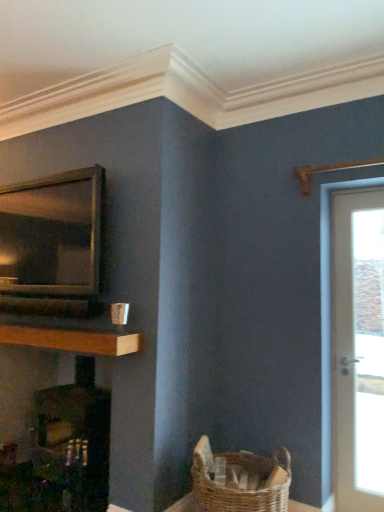
Question: From the image's perspective, relative to wooden at left, is matte black fireplace at left above or below?

Choices:
 (A) below
 (B) above

Answer: (A)

Question: Is point (99, 409) positioned closer to the camera than point (38, 335)?

Choices:
 (A) farther
 (B) closer

Answer: (A)

Question: Considering the real-world distances, which object is farthest from the white glossy door at right?

Choices:
 (A) matte black fireplace at left
 (B) wooden at left
 (C) metallic silver microwave at left

Answer: (C)

Question: Considering the real-world distances, which object is closest to the white glossy door at right?

Choices:
 (A) wooden at left
 (B) metallic silver microwave at left
 (C) matte black fireplace at left

Answer: (A)